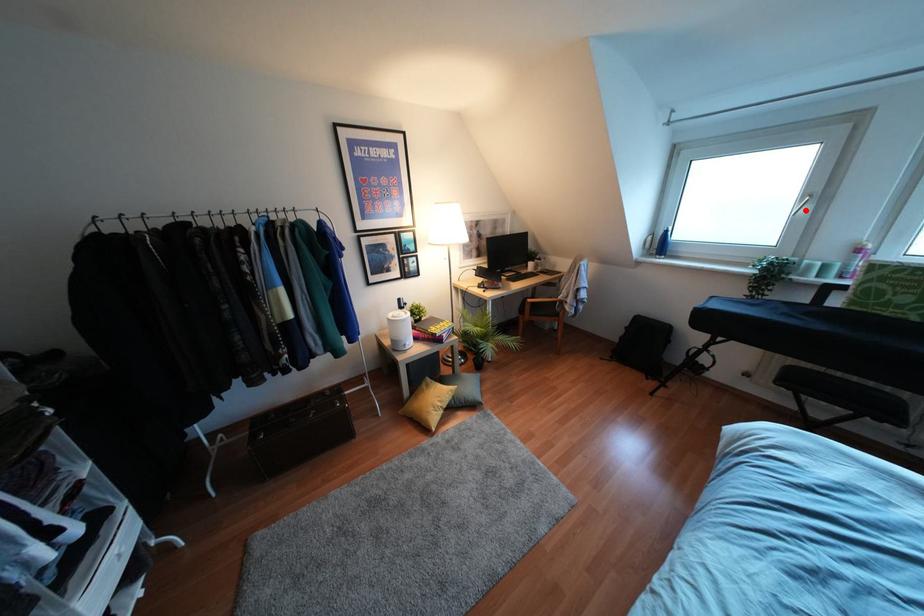
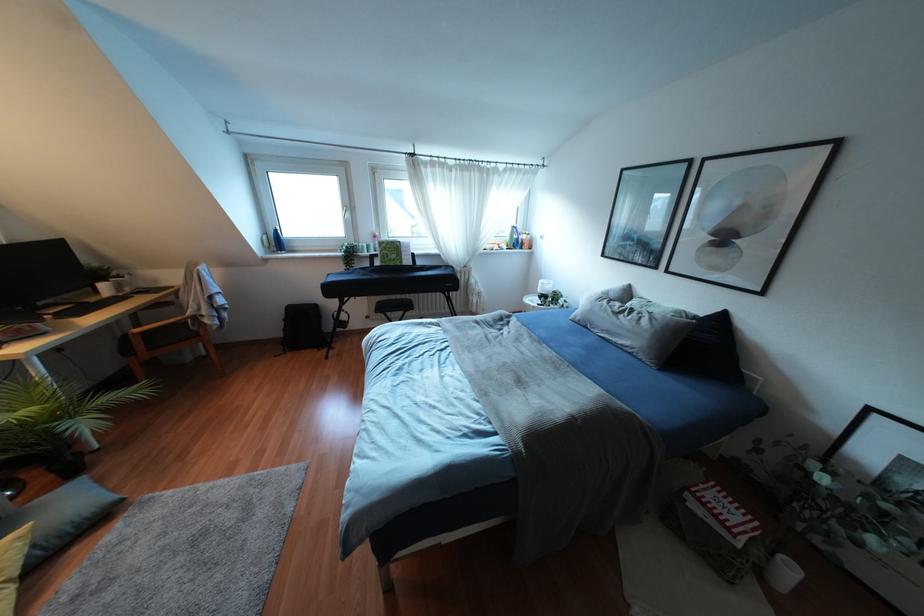
Question: I am providing you with two images of the same scene from different viewpoints. Given a red point in image1, look at the same physical point in image2. Is it:

Choices:
 (A) Closer to the viewpoint
 (B) Farther from the viewpoint

Answer: (A)